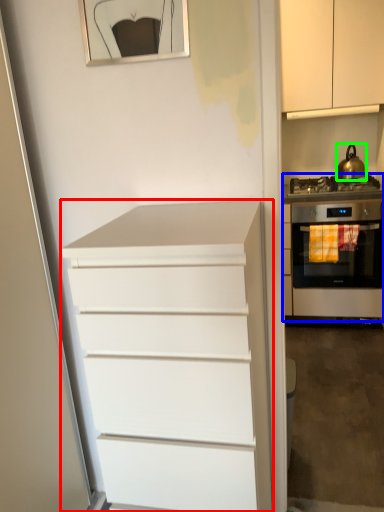
Question: Estimate the real-world distances between objects in this image. Which object is farther from chest of drawers (highlighted by a red box), home appliance (highlighted by a blue box) or kitchen appliance (highlighted by a green box)?

Choices:
 (A) home appliance
 (B) kitchen appliance

Answer: (B)